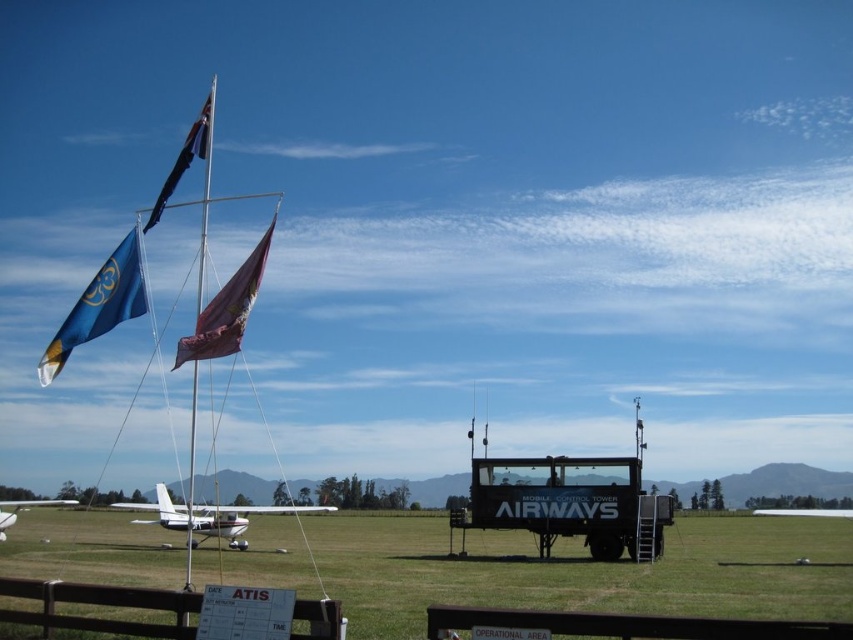
You are standing at the point labeled point (53, 349) and want to walk to the point labeled point (53, 504). Which direction should you face to walk directly towards your destination?

You should face north because point (53, 349) is in front of point (53, 504), indicating they are aligned along a northward direction.

You are a pilot preparing for takeoff and notice a blue fabric flag at upper left in the aviation scene. According to aviation safety protocols, what does the position of the flag indicate about wind direction?

The blue fabric flag at upper left indicates the wind direction. Since the flag points in the direction the wind is blowing, pilots should align their takeoff path with the wind for optimal safety and performance.